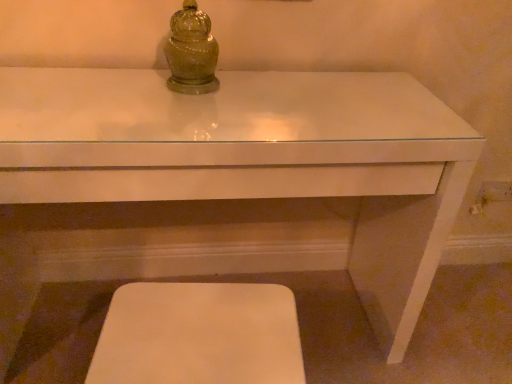
This screenshot has width=512, height=384. Find the location of `blank space to the left of green glass jar at upper center`. blank space to the left of green glass jar at upper center is located at coordinates (114, 85).